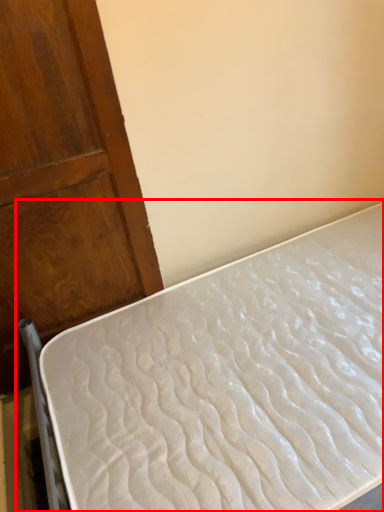
Question: From the image's perspective, what is the correct spatial positioning of bed (annotated by the red box) in reference to door?

Choices:
 (A) below
 (B) above

Answer: (A)